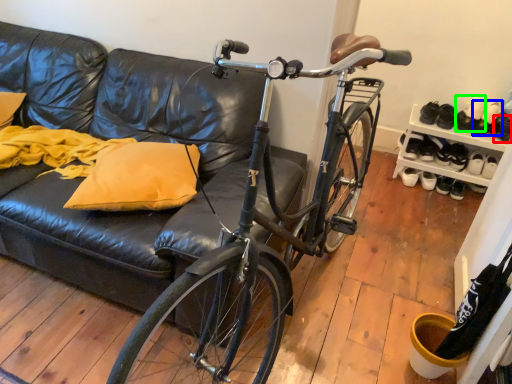
Question: Estimate the real-world distances between objects in this image. Which object is farther from shoe (highlighted by a red box), footwear (highlighted by a blue box) or footwear (highlighted by a green box)?

Choices:
 (A) footwear
 (B) footwear

Answer: (B)